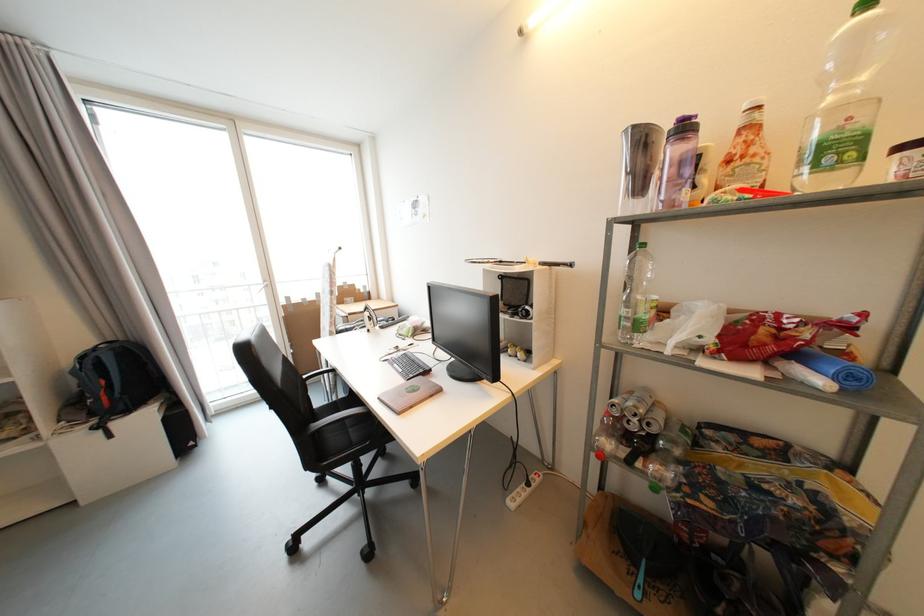
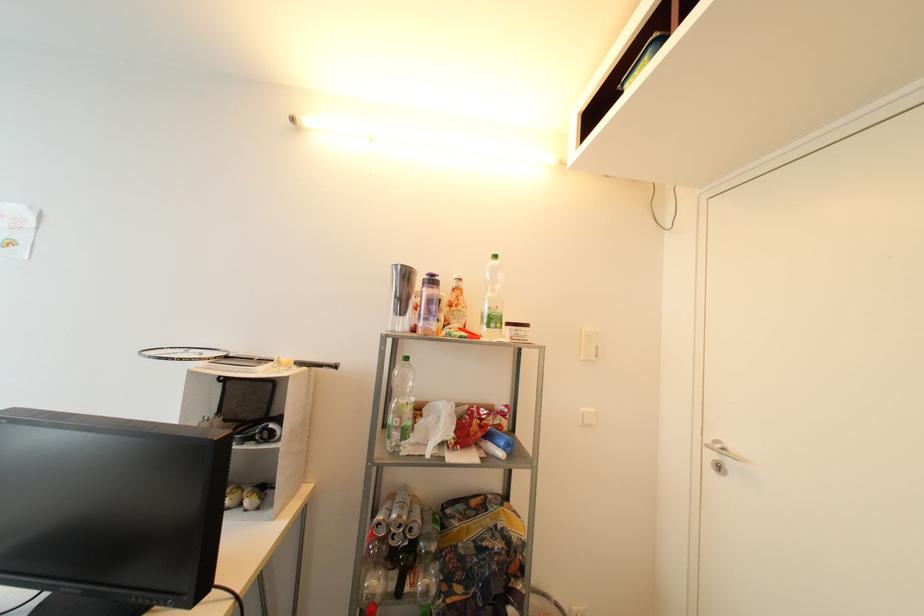
The point at (842, 151) is marked in the first image. Where is the corresponding point in the second image?

(499, 322)